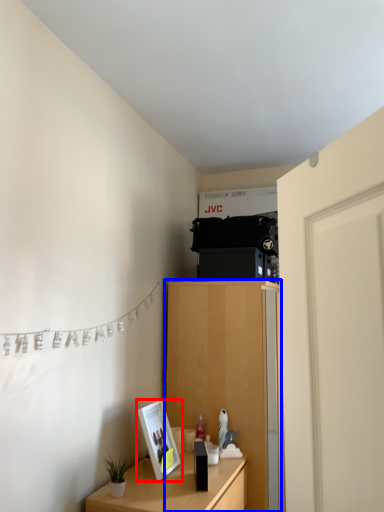
Question: Which object is closer to the camera taking this photo, picture frame (highlighted by a red box) or cabinetry (highlighted by a blue box)?

Choices:
 (A) picture frame
 (B) cabinetry

Answer: (A)